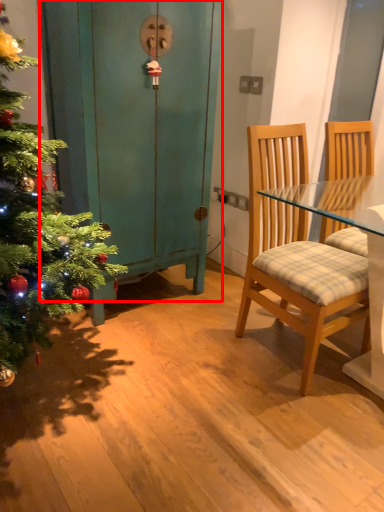
Question: Observing the image, what is the correct spatial positioning of dresser (annotated by the red box) in reference to chair?

Choices:
 (A) left
 (B) right

Answer: (A)